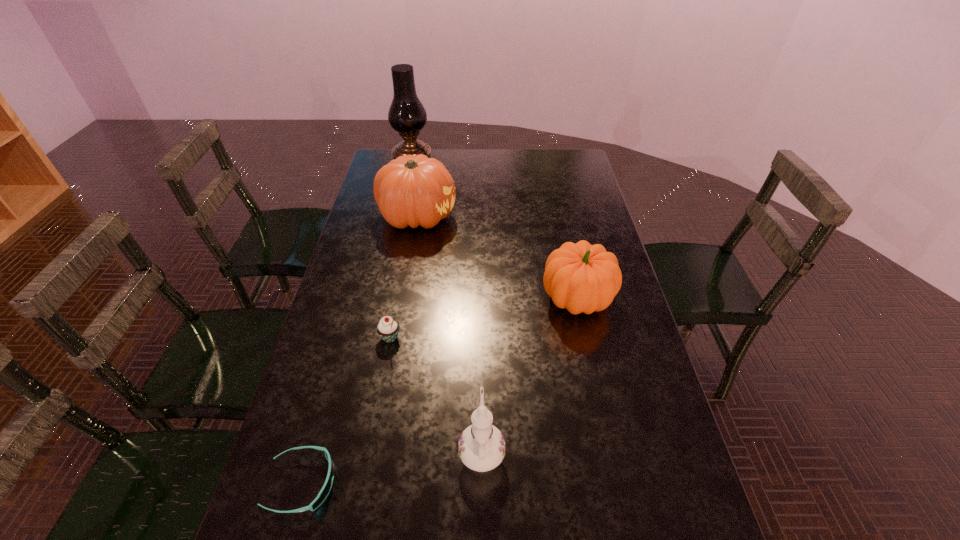
Where is `pumpkin that is positioned at the left edge`? The height and width of the screenshot is (540, 960). pumpkin that is positioned at the left edge is located at coordinates (412, 190).

The width and height of the screenshot is (960, 540). I want to click on sunglasses at the left edge, so click(326, 488).

This screenshot has width=960, height=540. Identify the location of object that is positioned at the right edge. (581, 277).

What are the coordinates of `object that is positioned at the far left corner` in the screenshot? It's located at (407, 115).

This screenshot has height=540, width=960. I want to click on free point at the left edge, so click(374, 239).

Identify the location of free space at the right edge. The height and width of the screenshot is (540, 960). (620, 323).

Locate an element on the screen. This screenshot has height=540, width=960. empty location between the chinaware and the shortest object is located at coordinates (392, 467).

Find the location of `free area in between the left pumpkin and the chinaware`. free area in between the left pumpkin and the chinaware is located at coordinates (449, 334).

At what (x,y) coordinates should I click in order to perform the action: click on vacant area that lies between the chinaware and the second farthest object. Please return your answer as a coordinate pair (x, y). Looking at the image, I should click on (449, 334).

The height and width of the screenshot is (540, 960). I want to click on free spot between the farthest object and the fifth object from left to right, so click(x=447, y=308).